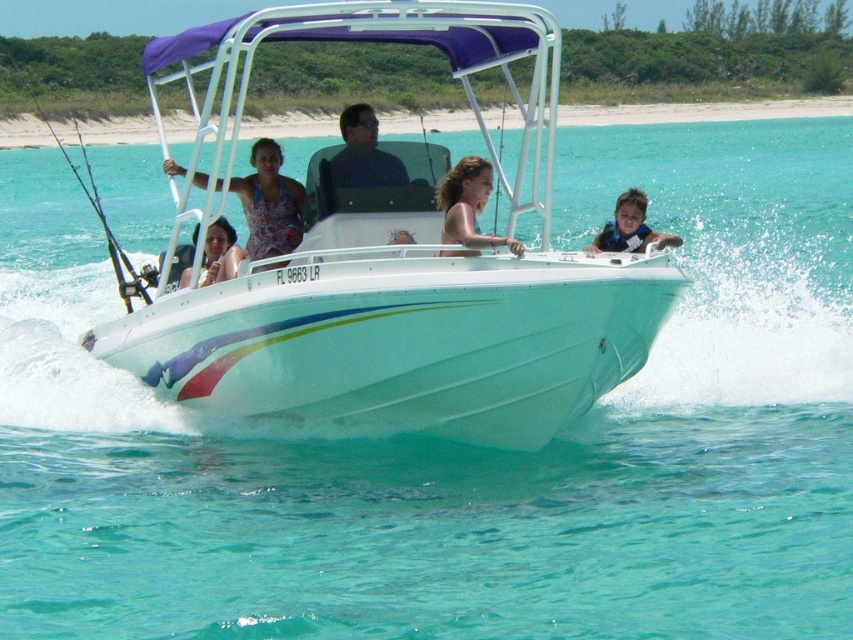
You are a safety inspector checking the boat for proper safety equipment. The white glossy boat at center has a registration number visible. Where is the matte pink swimsuit at center located relative to the boat?

The matte pink swimsuit at center is located below the white glossy boat at center because the white glossy boat at center is above it.

What are the coordinates of the blue life vest at center?

The blue life vest at center is located at point (630, 227).

What is the location of the matte floral dress at center in the image?

The matte floral dress at center is located at point coordinates of (270, 204).